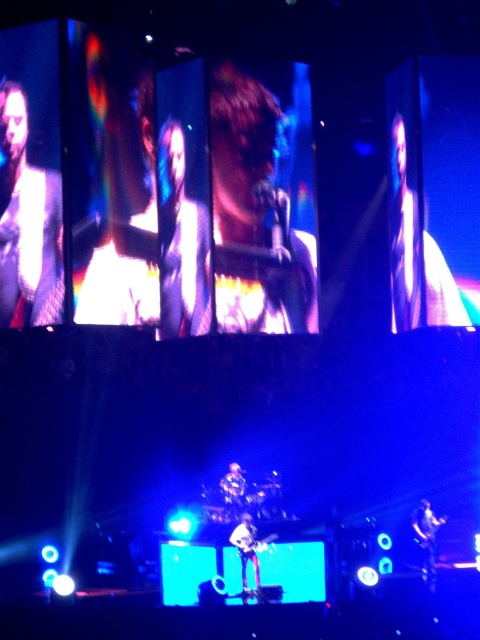
Who is more distant from viewer, (x=403, y=128) or (x=238, y=531)?

The point (x=403, y=128) is more distant.

Does matte black microphone at upper right have a lesser height compared to shiny silver guitar at center?

Yes.

Which is in front, point (397, 312) or point (254, 534)?

Positioned in front is point (254, 534).

Where is `matte black microphone at upper right`? matte black microphone at upper right is located at coordinates point(428,228).

Can you confirm if matte black jacket at left is positioned above shiny silver guitar at center?

Correct, matte black jacket at left is located above shiny silver guitar at center.

The height and width of the screenshot is (640, 480). I want to click on matte black jacket at left, so click(x=26, y=225).

Where is `matte black jacket at left`? The height and width of the screenshot is (640, 480). matte black jacket at left is located at coordinates (26, 225).

Who is more forward, (398, 316) or (1, 170)?

Point (1, 170)

Is point (396, 120) positioned before point (2, 157)?

No, it is behind (2, 157).

Who is more distant from viewer, (418, 166) or (22, 314)?

The point (418, 166) is behind.

Find the location of a particular element. Image resolution: width=480 pixels, height=640 pixels. matte black microphone at upper right is located at coordinates (428, 228).